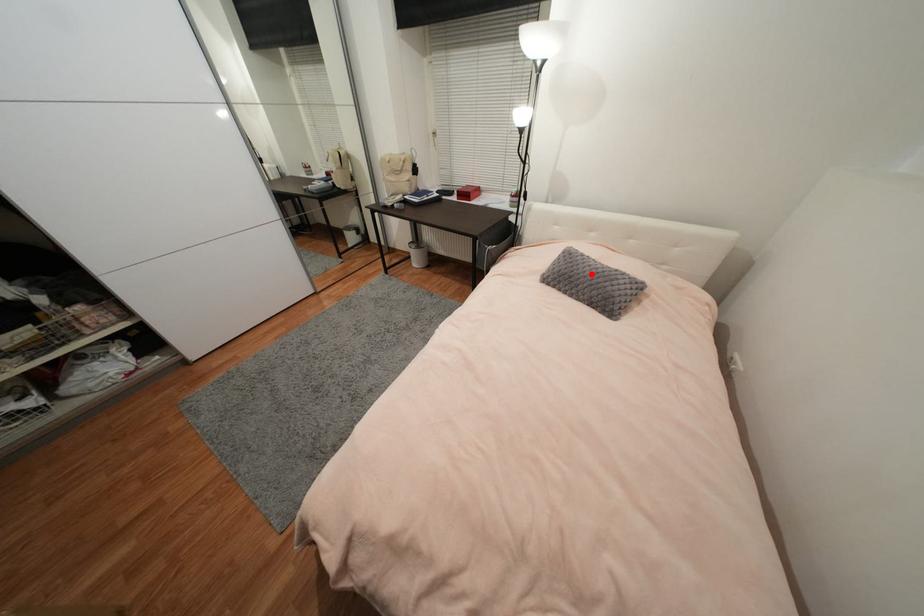
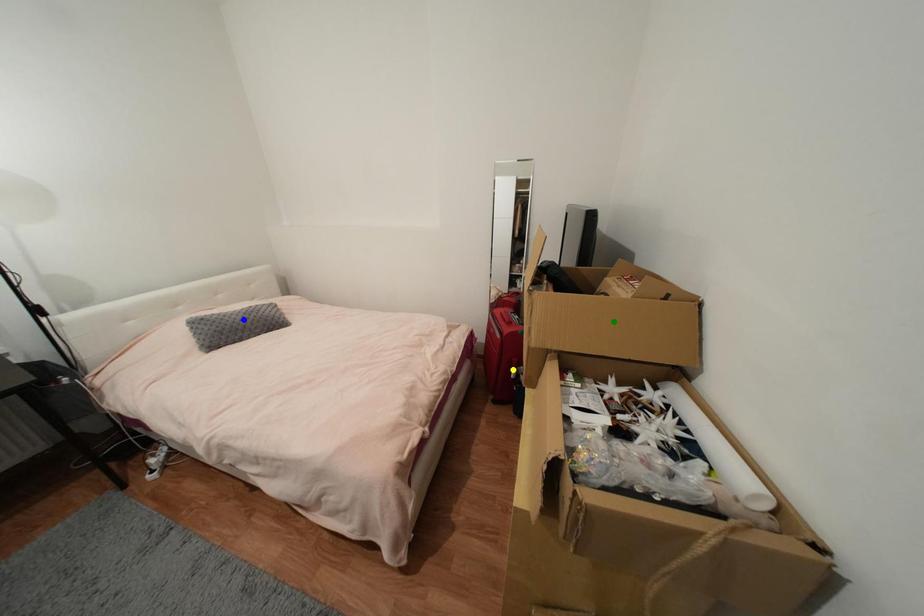
Question: I am providing you with two images of the same scene from different viewpoints. A red point is marked on the first image. You are given multiple points on the second image. Which spot in image 2 lines up with the point in image 1?

Choices:
 (A) blue point
 (B) green point
 (C) yellow point

Answer: (A)